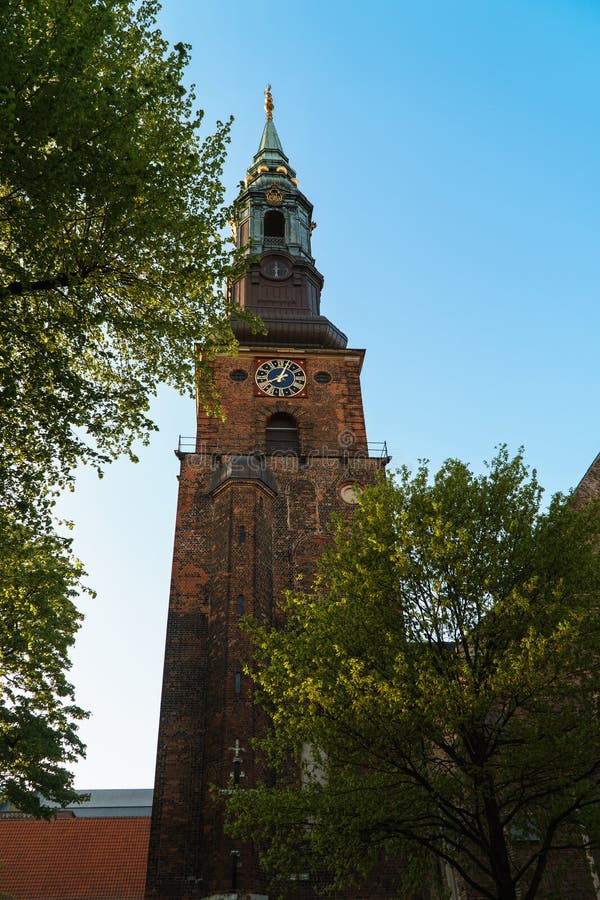
At what (x,y) coordinates should I click in order to perform the action: click on wall. Please return your answer as a coordinate pair (x, y). Looking at the image, I should click on (76, 850).